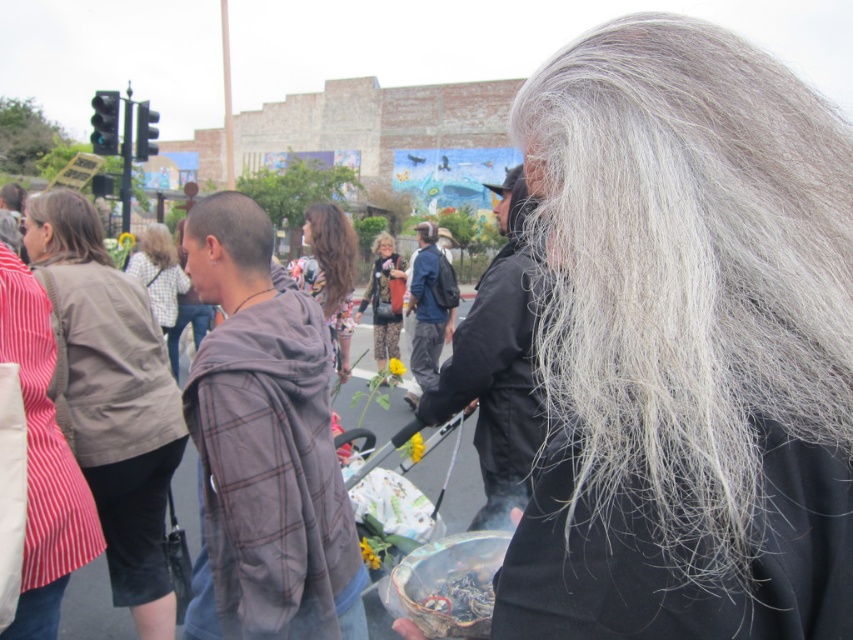
Does blonde hair at upper left lie behind brown matte hair at upper left?

No, it is in front of brown matte hair at upper left.

Is blonde hair at upper left positioned in front of brown matte hair at upper left?

That is True.

What are the coordinates of `blonde hair at upper left` in the screenshot? It's located at (68, 225).

Does gray woolen hair at upper right appear on the right side of brown wavy hair at center?

Correct, you'll find gray woolen hair at upper right to the right of brown wavy hair at center.

Is point (555, 65) in front of point (343, 264)?

That is True.

Is point (573, 266) positioned after point (312, 211)?

No, (573, 266) is closer to viewer.

Locate an element on the screen. Image resolution: width=853 pixels, height=640 pixels. gray woolen hair at upper right is located at coordinates (688, 346).

Who is more distant from viewer, [206,212] or [57,216]?

The point [57,216] is more distant.

Is plaid fabric hoodie at center shorter than blonde hair at upper left?

No.

Does point (316, 582) come farther from viewer compared to point (79, 214)?

No, (316, 582) is in front of (79, 214).

Locate an element on the screen. The width and height of the screenshot is (853, 640). plaid fabric hoodie at center is located at coordinates (264, 445).